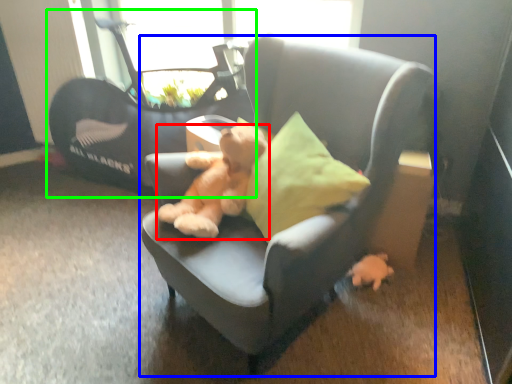
Question: Which object is the closest to the teddy bear (highlighted by a red box)? Choose among these: chair (highlighted by a blue box) or baby carriage (highlighted by a green box).

Choices:
 (A) chair
 (B) baby carriage

Answer: (A)